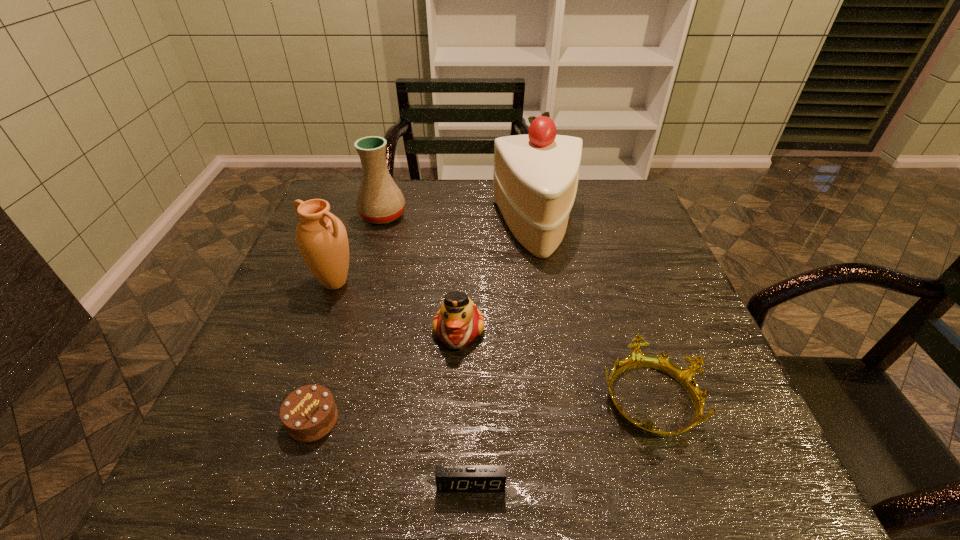
Identify the location of free spot between the shortest object and the tallest object. This screenshot has width=960, height=540. (504, 356).

Image resolution: width=960 pixels, height=540 pixels. Find the location of `free space between the urn and the pottery`. free space between the urn and the pottery is located at coordinates coord(359,249).

You are a GUI agent. You are given a task and a screenshot of the screen. Output one action in this format:
    pyautogui.click(x=<x>, y=<y>)
    Task: Click on the vacant point located between the crown and the pottery
    This screenshot has height=540, width=960.
    Given the screenshot: What is the action you would take?
    pyautogui.click(x=516, y=307)

Where is `vacant space in between the fifth nearest object and the fourth farthest object`? The image size is (960, 540). vacant space in between the fifth nearest object and the fourth farthest object is located at coordinates (396, 307).

At what (x,y) coordinates should I click in order to perform the action: click on vacant space that is in between the urn and the pottery. Please return your answer as a coordinate pair (x, y). This screenshot has width=960, height=540. Looking at the image, I should click on (359, 249).

Locate an element on the screen. The height and width of the screenshot is (540, 960). empty space between the urn and the tallest object is located at coordinates (436, 255).

Locate an element on the screen. vacant area between the tallest object and the chocolate cake is located at coordinates (425, 324).

You are a GUI agent. You are given a task and a screenshot of the screen. Output one action in this format:
    pyautogui.click(x=<x>, y=<y>)
    Task: Click on the free space between the fifth nearest object and the pottery
    
    Given the screenshot: What is the action you would take?
    pyautogui.click(x=359, y=249)

Where is `free space between the duck and the crown`? free space between the duck and the crown is located at coordinates (554, 364).

Locate an element on the screen. free spot between the fourth shortest object and the cake is located at coordinates (498, 279).